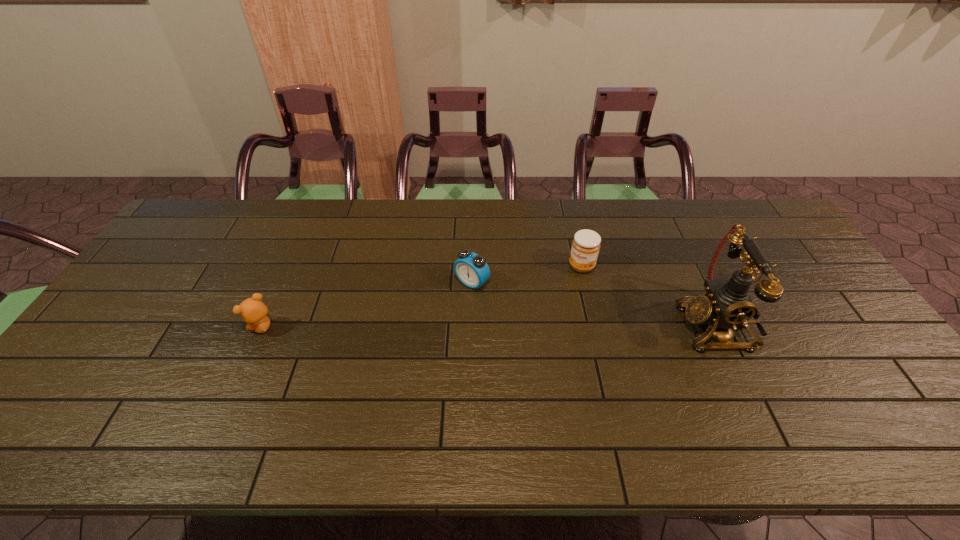
Identify the location of empty space that is in between the second object from right to left and the third object from right to left. (527, 275).

The width and height of the screenshot is (960, 540). What are the coordinates of `free space between the jam and the teddy bear` in the screenshot? It's located at (422, 297).

Where is `object that is the closest to the alarm clock`? The height and width of the screenshot is (540, 960). object that is the closest to the alarm clock is located at coordinates (585, 248).

Where is `object that stands as the closest to the tallest object`? object that stands as the closest to the tallest object is located at coordinates (585, 248).

Where is `free spot that satisfies the following two spatial constraints: 1. on the front side of the second object from left to right; 2. on the front of the tallest object, featuring the rotary dial`? The width and height of the screenshot is (960, 540). free spot that satisfies the following two spatial constraints: 1. on the front side of the second object from left to right; 2. on the front of the tallest object, featuring the rotary dial is located at coordinates (471, 326).